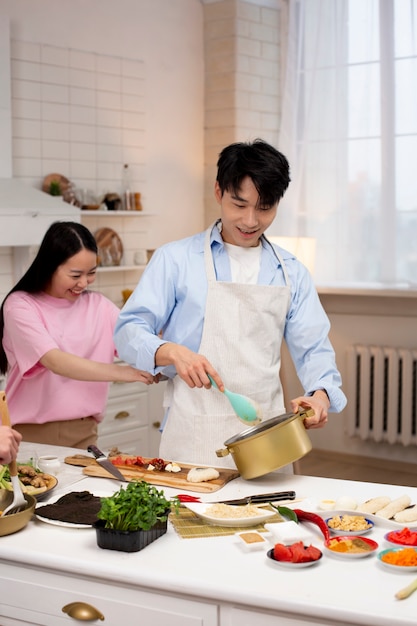
You are a GUI agent. You are given a task and a screenshot of the screen. Output one action in this format:
    pyautogui.click(x=<x>, y=<y>)
    Task: Click on the counter top
    This screenshot has height=626, width=417.
    Given the screenshot: What is the action you would take?
    pyautogui.click(x=208, y=544)